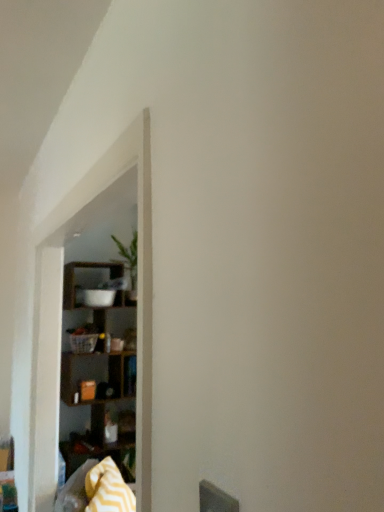
Question: Considering the relative sizes of wooden shelf at left and yellow zigzag blanket at lower left in the image provided, is wooden shelf at left smaller than yellow zigzag blanket at lower left?

Choices:
 (A) no
 (B) yes

Answer: (A)

Question: Is wooden shelf at left facing towards yellow zigzag blanket at lower left?

Choices:
 (A) yes
 (B) no

Answer: (A)

Question: Is wooden shelf at left thinner than yellow zigzag blanket at lower left?

Choices:
 (A) yes
 (B) no

Answer: (B)

Question: Is the position of wooden shelf at left less distant than that of yellow zigzag blanket at lower left?

Choices:
 (A) yes
 (B) no

Answer: (B)

Question: From a real-world perspective, is wooden shelf at left on yellow zigzag blanket at lower left?

Choices:
 (A) yes
 (B) no

Answer: (A)

Question: Would you say wooden shelf at left is outside yellow zigzag blanket at lower left?

Choices:
 (A) no
 (B) yes

Answer: (B)

Question: From the image's perspective, is yellow zigzag blanket at lower left on top of wooden shelf at left?

Choices:
 (A) no
 (B) yes

Answer: (A)

Question: Considering the relative sizes of yellow zigzag blanket at lower left and wooden shelf at left in the image provided, is yellow zigzag blanket at lower left smaller than wooden shelf at left?

Choices:
 (A) yes
 (B) no

Answer: (A)

Question: From a real-world perspective, is yellow zigzag blanket at lower left below wooden shelf at left?

Choices:
 (A) no
 (B) yes

Answer: (B)

Question: Can wooden shelf at left be found inside yellow zigzag blanket at lower left?

Choices:
 (A) no
 (B) yes

Answer: (A)

Question: Are yellow zigzag blanket at lower left and wooden shelf at left beside each other?

Choices:
 (A) yes
 (B) no

Answer: (B)

Question: Considering the relative positions of yellow zigzag blanket at lower left and wooden shelf at left in the image provided, is yellow zigzag blanket at lower left in front of wooden shelf at left?

Choices:
 (A) yes
 (B) no

Answer: (A)

Question: Does green leafy plant at upper center have a smaller size compared to yellow zigzag blanket at lower left?

Choices:
 (A) no
 (B) yes

Answer: (B)